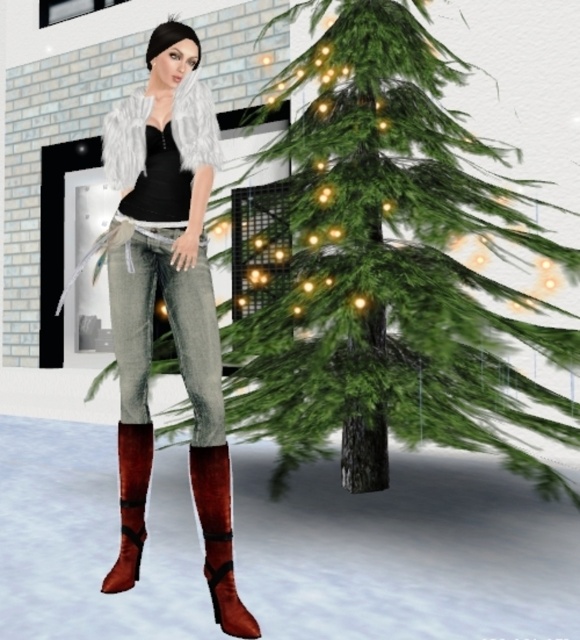
Question: Does suede boots at lower center lie in front of velvet red boot at lower left?

Choices:
 (A) no
 (B) yes

Answer: (B)

Question: Where is green matte christmas tree at center located in relation to suede boots at lower center in the image?

Choices:
 (A) above
 (B) below

Answer: (A)

Question: Which point is farther to the camera?

Choices:
 (A) velvet red boot at lower left
 (B) green matte christmas tree at center
 (C) suede boots at lower center
 (D) suede/leather boot at lower center

Answer: (B)

Question: Is suede boots at lower center smaller than suede/leather boot at lower center?

Choices:
 (A) yes
 (B) no

Answer: (B)

Question: Considering the real-world distances, which object is closest to the suede boots at lower center?

Choices:
 (A) velvet red boot at lower left
 (B) suede/leather boot at lower center
 (C) green matte christmas tree at center

Answer: (B)

Question: Which of the following is the closest to the observer?

Choices:
 (A) (454, 417)
 (B) (106, 156)
 (C) (222, 620)
 (D) (125, 433)

Answer: (C)